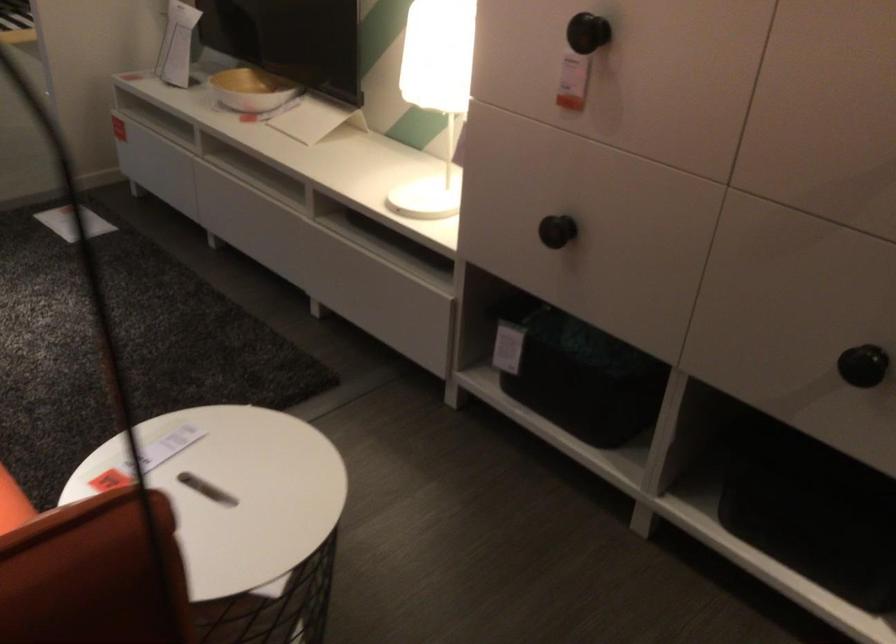
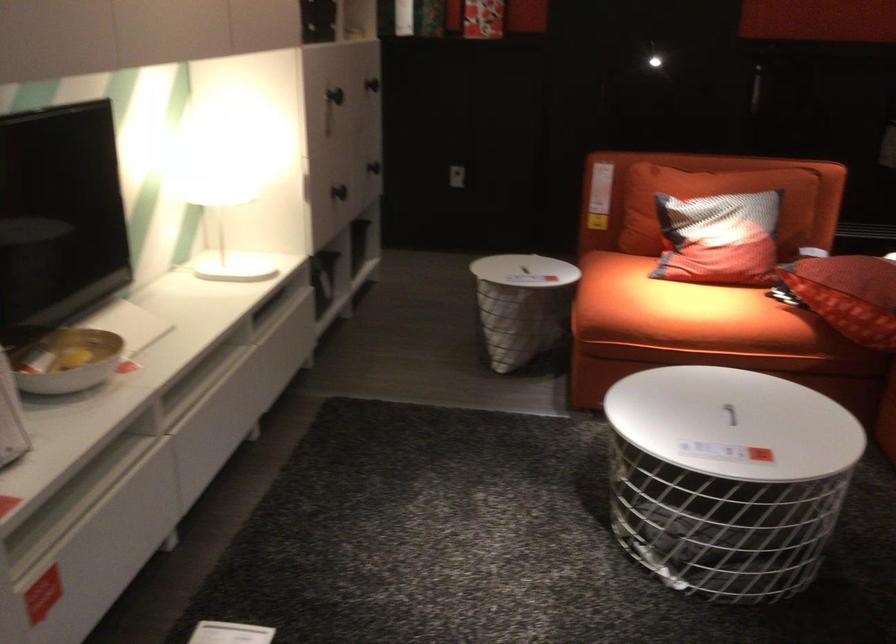
The point at (167, 118) is marked in the first image. Where is the corresponding point in the second image?

(74, 500)